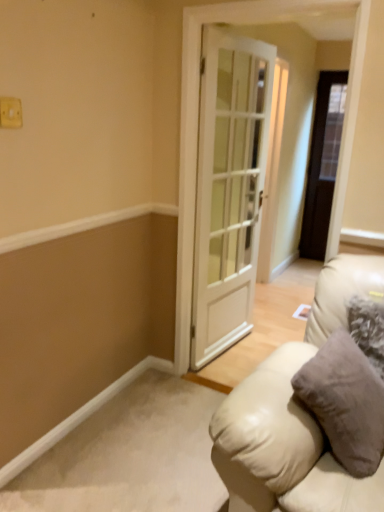
Question: Does dark wood door at right, marked as the second door in a front-to-back arrangement, appear on the right side of white plastic light switch at upper left?

Choices:
 (A) yes
 (B) no

Answer: (A)

Question: Are dark wood door at right, marked as the second door in a front-to-back arrangement, and white plastic light switch at upper left located far from each other?

Choices:
 (A) no
 (B) yes

Answer: (B)

Question: From a real-world perspective, is dark wood door at right, placed as the 1th door when sorted from right to left, on white plastic light switch at upper left?

Choices:
 (A) yes
 (B) no

Answer: (B)

Question: Is dark wood door at right, marked as the second door in a front-to-back arrangement, at the left side of white plastic light switch at upper left?

Choices:
 (A) yes
 (B) no

Answer: (B)

Question: Considering the relative sizes of dark wood door at right, placed as the 1th door when sorted from right to left, and white plastic light switch at upper left in the image provided, is dark wood door at right, placed as the 1th door when sorted from right to left, wider than white plastic light switch at upper left?

Choices:
 (A) yes
 (B) no

Answer: (A)

Question: From the image's perspective, does dark wood door at right, which is the 1th door in back-to-front order, appear higher than white plastic light switch at upper left?

Choices:
 (A) no
 (B) yes

Answer: (B)

Question: Is beige leather couch at lower right to the right of white plastic light switch at upper left from the viewer's perspective?

Choices:
 (A) no
 (B) yes

Answer: (B)

Question: Can you confirm if beige leather couch at lower right is positioned to the left of white plastic light switch at upper left?

Choices:
 (A) yes
 (B) no

Answer: (B)

Question: Considering the relative sizes of beige leather couch at lower right and white plastic light switch at upper left in the image provided, is beige leather couch at lower right taller than white plastic light switch at upper left?

Choices:
 (A) no
 (B) yes

Answer: (B)

Question: Is beige leather couch at lower right shorter than white plastic light switch at upper left?

Choices:
 (A) no
 (B) yes

Answer: (A)

Question: Is beige leather couch at lower right far away from white plastic light switch at upper left?

Choices:
 (A) yes
 (B) no

Answer: (A)

Question: Is beige leather couch at lower right surrounding white plastic light switch at upper left?

Choices:
 (A) yes
 (B) no

Answer: (B)

Question: Considering the relative positions of white plastic light switch at upper left and dark wood door at right, which is the 1th door in back-to-front order, in the image provided, is white plastic light switch at upper left to the right of dark wood door at right, which is the 1th door in back-to-front order, from the viewer's perspective?

Choices:
 (A) yes
 (B) no

Answer: (B)